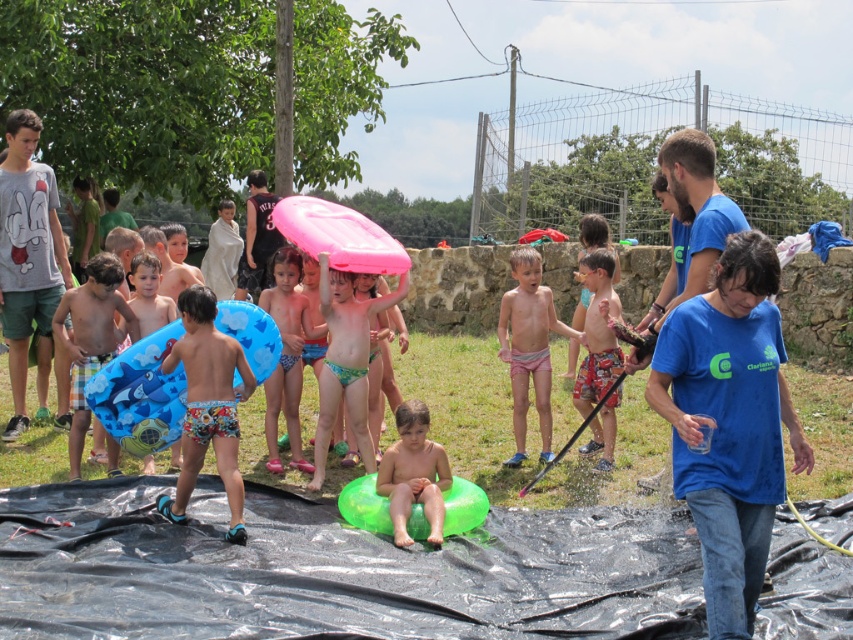
Is point (512, 321) behind point (294, 285)?

No.

Can you confirm if pink fabric shorts at center is positioned to the left of pink rubber ring at center?

No, pink fabric shorts at center is not to the left of pink rubber ring at center.

You are a GUI agent. You are given a task and a screenshot of the screen. Output one action in this format:
    pyautogui.click(x=<x>, y=<y>)
    Task: Click on the pink fabric shorts at center
    
    Given the screenshot: What is the action you would take?
    pyautogui.click(x=527, y=346)

Measure the distance between pink rubber ring at center and camera.

pink rubber ring at center is 8.32 meters away from camera.

Is pink rubber ring at center thinner than smooth green float at center?

Incorrect, pink rubber ring at center's width is not less than smooth green float at center's.

Is point (293, 276) closer to camera compared to point (401, 458)?

No, (293, 276) is further to viewer.

Where is `pink rubber ring at center`? The height and width of the screenshot is (640, 853). pink rubber ring at center is located at coordinates (286, 355).

Is floral-patterned shorts at center positioned in front of pink rubber ring at center?

Yes.

Can you confirm if floral-patterned shorts at center is positioned to the left of pink rubber ring at center?

Yes, floral-patterned shorts at center is to the left of pink rubber ring at center.

Who is more forward, (194, 413) or (289, 417)?

Positioned in front is point (194, 413).

The image size is (853, 640). Identify the location of floral-patterned shorts at center. (207, 404).